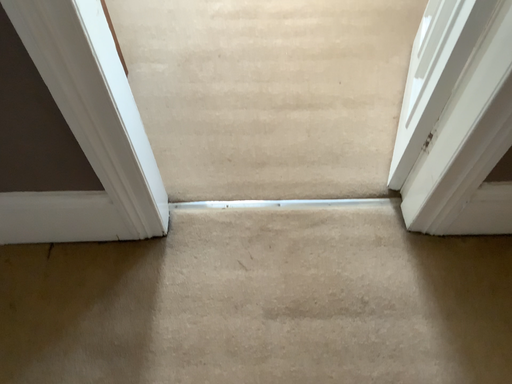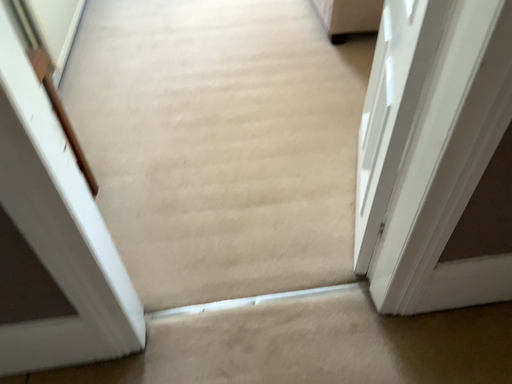
Question: Which way did the camera rotate in the video?

Choices:
 (A) rotated downward
 (B) rotated upward

Answer: (B)